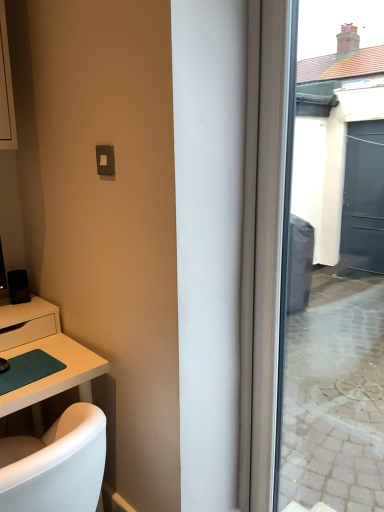
Describe the element at coordinates (318, 274) in the screenshot. I see `transparent glass window at right` at that location.

Where is `transparent glass window at right`? transparent glass window at right is located at coordinates (318, 274).

In the scene shown: Measure the distance between point (x=382, y=482) and camera.

Point (x=382, y=482) and camera are 7.41 feet apart from each other.

The width and height of the screenshot is (384, 512). In order to click on transparent glass window at right in this screenshot , I will do `click(318, 274)`.